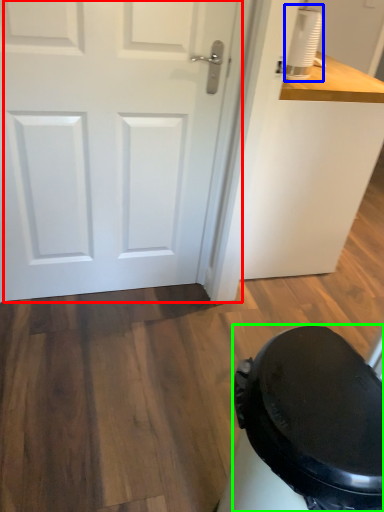
Question: Which object is the closest to the door (highlighted by a red box)? Choose among these: appliance (highlighted by a blue box) or potty (highlighted by a green box).

Choices:
 (A) appliance
 (B) potty

Answer: (A)